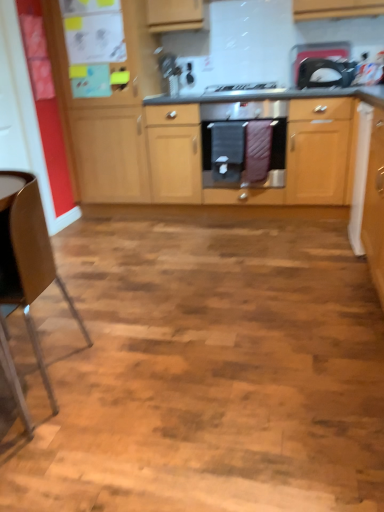
Question: Is the surface of black fabric oven mitts at center in direct contact with white glossy microwave at upper right?

Choices:
 (A) no
 (B) yes

Answer: (A)

Question: Can you confirm if black fabric oven mitts at center is thinner than white glossy microwave at upper right?

Choices:
 (A) yes
 (B) no

Answer: (B)

Question: Considering the relative sizes of black fabric oven mitts at center and white glossy microwave at upper right in the image provided, is black fabric oven mitts at center wider than white glossy microwave at upper right?

Choices:
 (A) no
 (B) yes

Answer: (B)

Question: Is black fabric oven mitts at center facing towards white glossy microwave at upper right?

Choices:
 (A) yes
 (B) no

Answer: (B)

Question: Can you confirm if black fabric oven mitts at center is positioned to the right of white glossy microwave at upper right?

Choices:
 (A) yes
 (B) no

Answer: (B)

Question: From a real-world perspective, is brown leather chair at left positioned above or below white glossy microwave at upper right?

Choices:
 (A) above
 (B) below

Answer: (B)

Question: Considering the positions of point (34, 342) and point (304, 87), is point (34, 342) closer or farther from the camera than point (304, 87)?

Choices:
 (A) farther
 (B) closer

Answer: (B)

Question: Is brown leather chair at left wider or thinner than white glossy microwave at upper right?

Choices:
 (A) thin
 (B) wide

Answer: (B)

Question: Which is correct: brown leather chair at left is inside white glossy microwave at upper right, or outside of it?

Choices:
 (A) inside
 (B) outside

Answer: (B)

Question: From the image's perspective, is black fabric oven mitts at center above or below brown leather chair at left?

Choices:
 (A) above
 (B) below

Answer: (A)

Question: Is point (231, 120) positioned closer to the camera than point (0, 243)?

Choices:
 (A) closer
 (B) farther

Answer: (B)

Question: From a real-world perspective, is black fabric oven mitts at center above or below brown leather chair at left?

Choices:
 (A) below
 (B) above

Answer: (B)

Question: Is black fabric oven mitts at center inside the boundaries of brown leather chair at left, or outside?

Choices:
 (A) outside
 (B) inside

Answer: (A)

Question: Is white glossy microwave at upper right in front of or behind wooden cabinets at center in the image?

Choices:
 (A) front
 (B) behind

Answer: (B)

Question: Is white glossy microwave at upper right situated inside wooden cabinets at center or outside?

Choices:
 (A) inside
 (B) outside

Answer: (B)